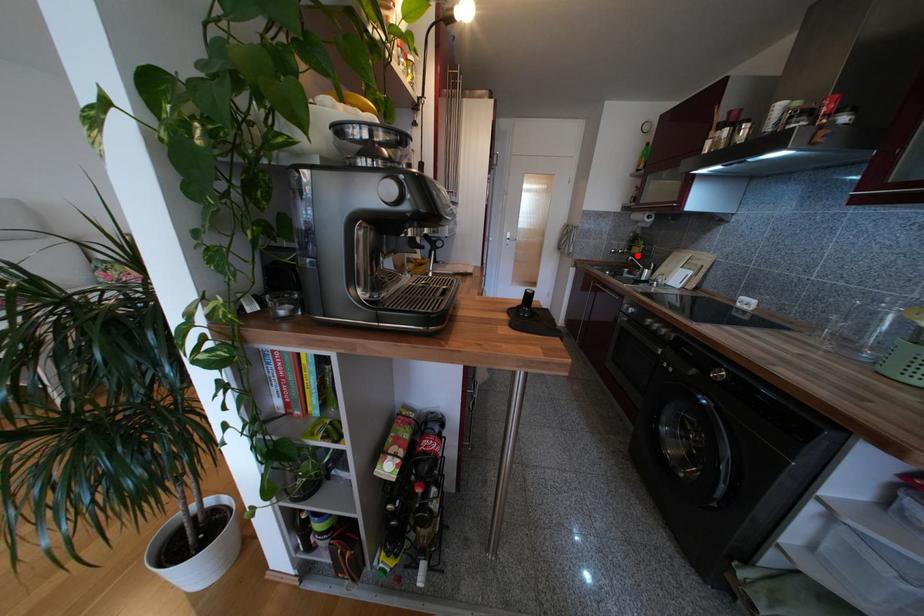
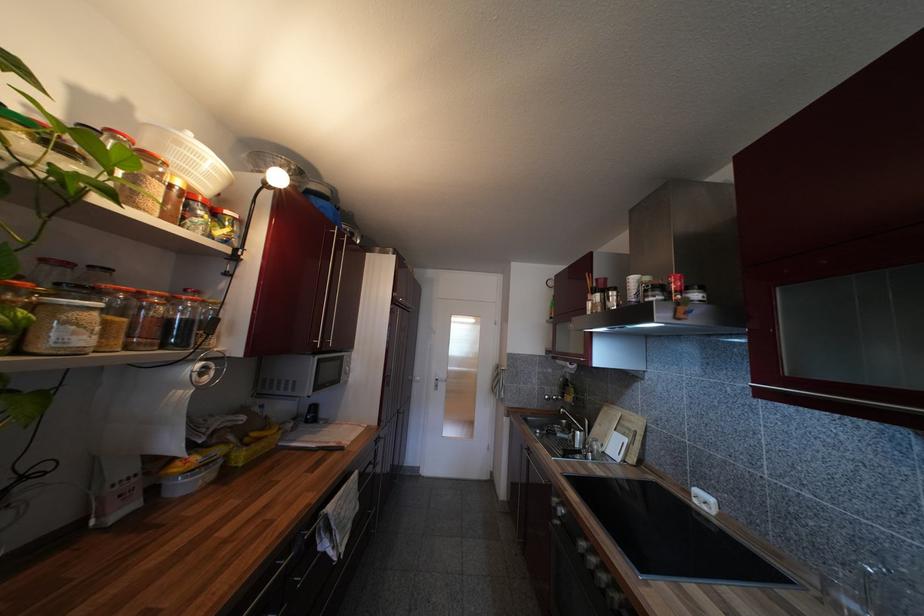
Question: A red point is marked in image1. In image2, is the corresponding 3D point closer to the camera or farther? Reply with the corresponding letter.

Choices:
 (A) The corresponding 3D point is closer.
 (B) The corresponding 3D point is farther.

Answer: (B)